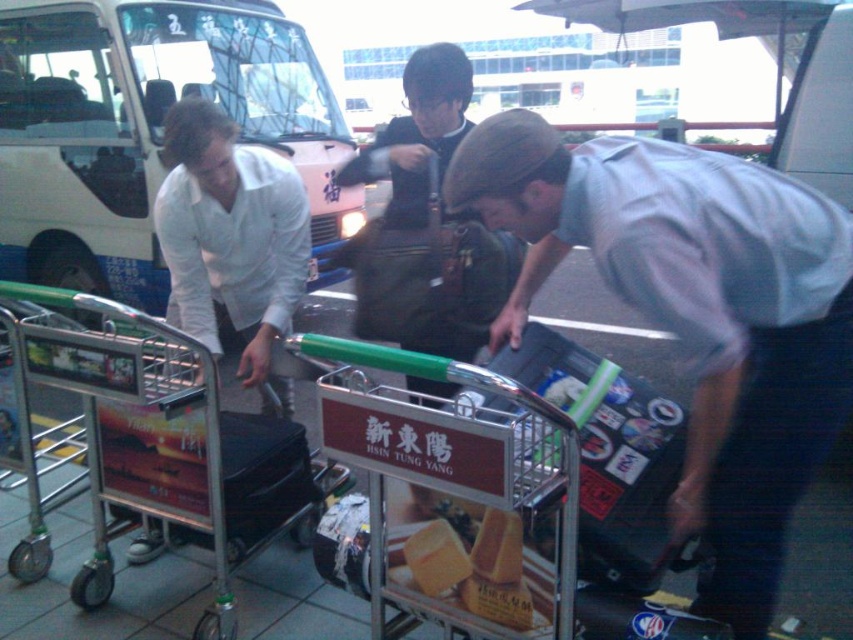
You are a passenger trying to find your luggage cart. You see a matte gray shirt at center and a metallic silver trolley at center. Which one is to the right of the other?

The matte gray shirt at center is positioned on the right side of metallic silver trolley at center, so the matte gray shirt at center is to the right of the metallic silver trolley at center.

You are a passenger waiting at the airport. You see a pink matte bus at upper left and a yellow matte bread at center. Which object is positioned higher in the image?

The pink matte bus at upper left is positioned higher than the yellow matte bread at center.